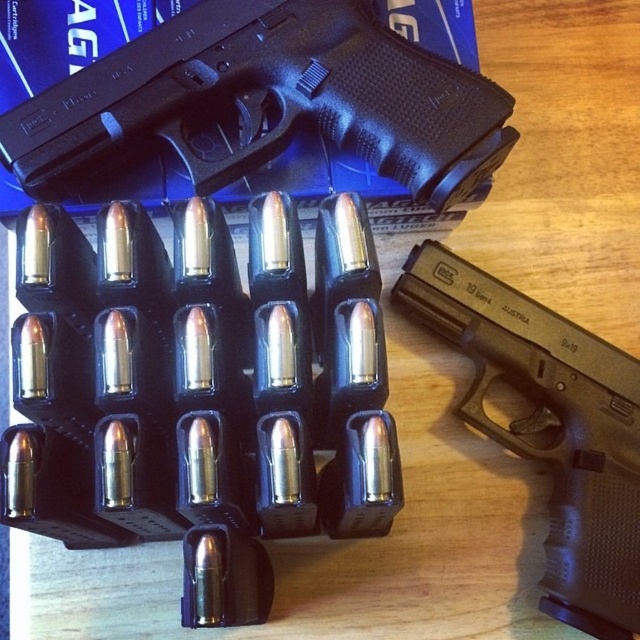
Question: Is black rubber handgun at upper center further to the viewer compared to black plastic handgun at center?

Choices:
 (A) yes
 (B) no

Answer: (A)

Question: Is black rubber handgun at upper center positioned before black plastic handgun at center?

Choices:
 (A) no
 (B) yes

Answer: (A)

Question: Which of the following is the closest to the observer?

Choices:
 (A) [534, 356]
 (B) [236, 61]

Answer: (B)

Question: Among these objects, which one is farthest from the camera?

Choices:
 (A) black plastic handgun at center
 (B) black rubber handgun at upper center

Answer: (B)

Question: Which of the following is the farthest from the observer?

Choices:
 (A) (417, 115)
 (B) (632, 632)

Answer: (A)

Question: Is black rubber handgun at upper center positioned in front of black plastic handgun at center?

Choices:
 (A) yes
 (B) no

Answer: (B)